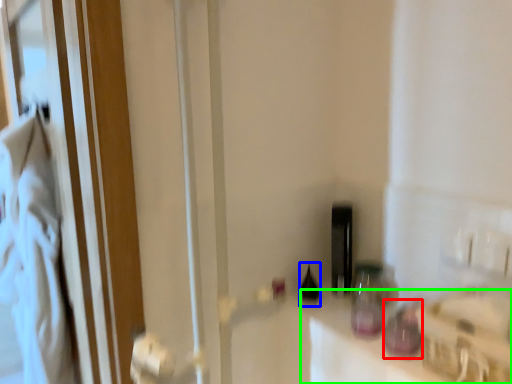
Question: Which object is positioned closest to bottle (highlighted by a red box)? Select from bottle (highlighted by a blue box) and counter top (highlighted by a green box).

Choices:
 (A) bottle
 (B) counter top

Answer: (B)